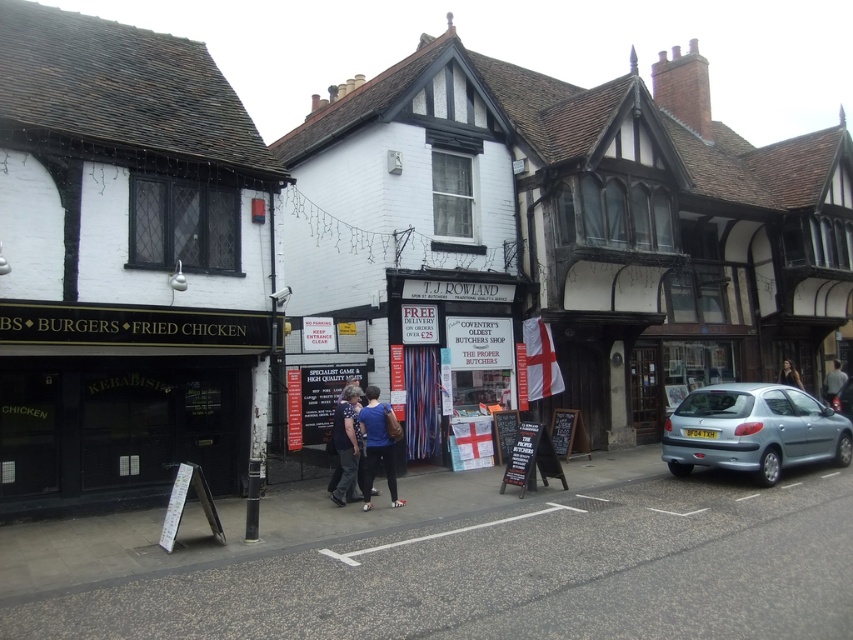
You are a pedestrian standing on the street and want to see both the blue denim jeans at center and the dark hair at center. Which one do you need to look at first?

The blue denim jeans at center is in front of the dark hair at center, so you need to look at the blue denim jeans at center first before you can see the dark hair at center behind it.